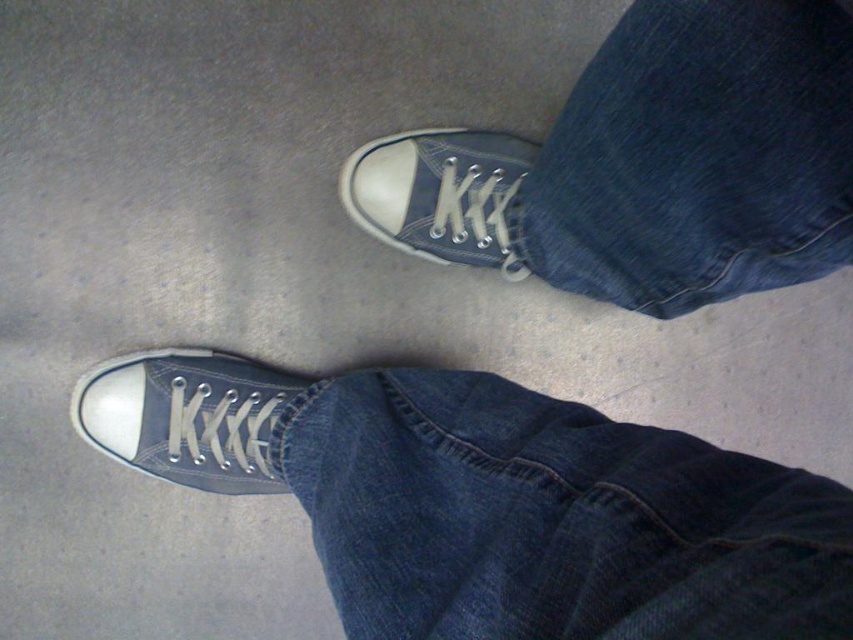
You are a photographer adjusting your camera focus. You notice two denim areas in the image, the denim at lower center and the denim at center. Which denim area should you focus on first if you want to ensure the closer one is sharp?

The denim at lower center is closer to the viewer than the denim at center, so you should focus on the denim at lower center first to ensure it is sharp.

You are trying to decide between two pairs of shoes to buy. You have a small box that can only hold items up to 10 inches in width. You see the matte canvas sneaker at lower left and the matte canvas shoe at center in the image. Which one is more likely to fit in the box based on their widths?

The matte canvas sneaker at lower left might be wider than the matte canvas shoe at center, so it is more likely to not fit in the box if the box can only hold items up to 10 inches in width. The matte canvas shoe at center is narrower and has a better chance of fitting.